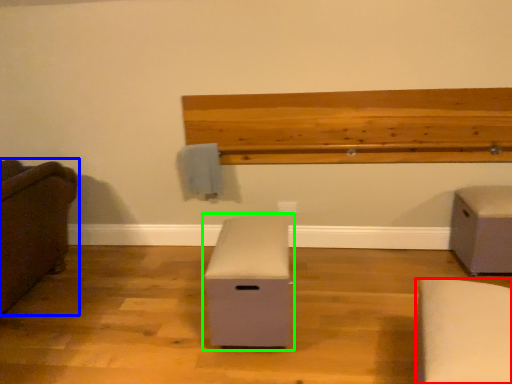
Question: Estimate the real-world distances between objects in this image. Which object is farther from furniture (highlighted by a red box), furniture (highlighted by a blue box) or furniture (highlighted by a green box)?

Choices:
 (A) furniture
 (B) furniture

Answer: (A)